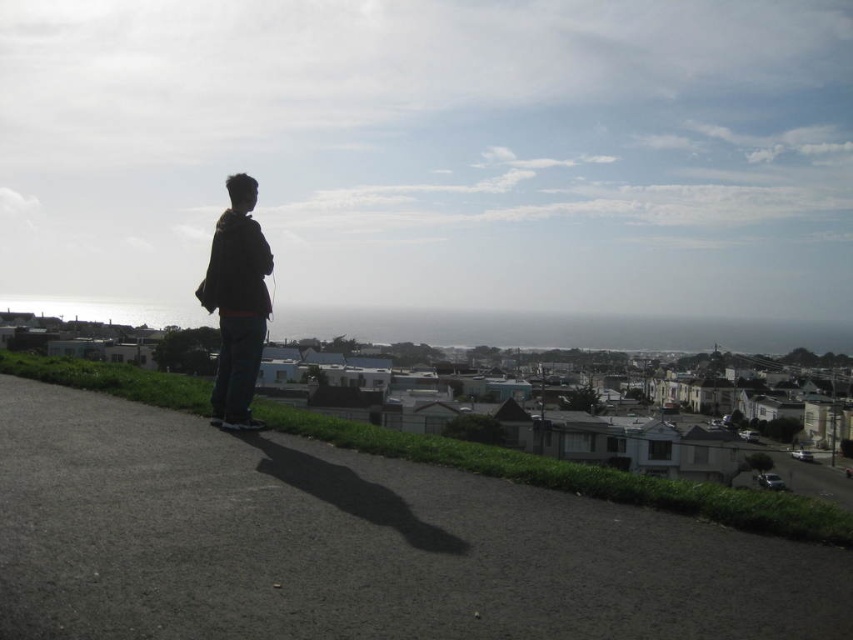
Question: Can you confirm if dark asphalt pavement at lower left is smaller than dark brown jacket at center?

Choices:
 (A) no
 (B) yes

Answer: (B)

Question: Is dark asphalt pavement at lower left thinner than dark brown jacket at center?

Choices:
 (A) no
 (B) yes

Answer: (A)

Question: Which object appears closest to the camera in this image?

Choices:
 (A) dark brown jacket at center
 (B) dark asphalt pavement at lower left

Answer: (B)

Question: Which of the following is the closest to the observer?

Choices:
 (A) dark brown jacket at center
 (B) dark asphalt pavement at lower left

Answer: (B)

Question: Observing the image, what is the correct spatial positioning of dark asphalt pavement at lower left in reference to dark brown jacket at center?

Choices:
 (A) left
 (B) right

Answer: (B)